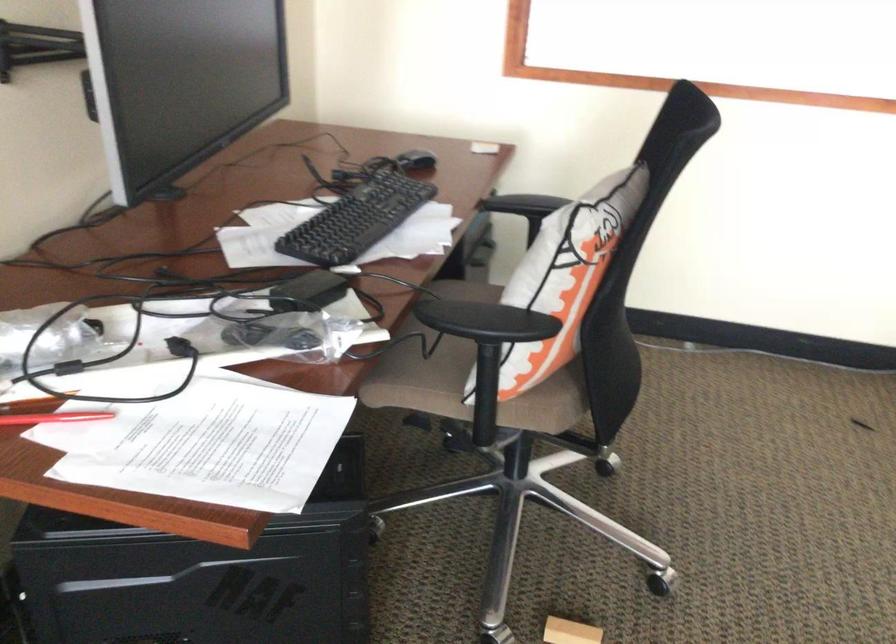
I want to click on small wooden block, so click(x=570, y=632).